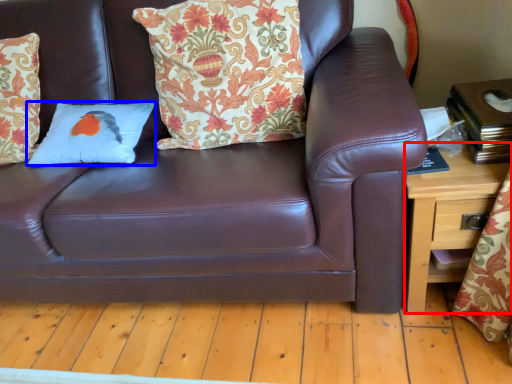
Question: Which object is further to the camera taking this photo, table (highlighted by a red box) or pillow (highlighted by a blue box)?

Choices:
 (A) table
 (B) pillow

Answer: (B)